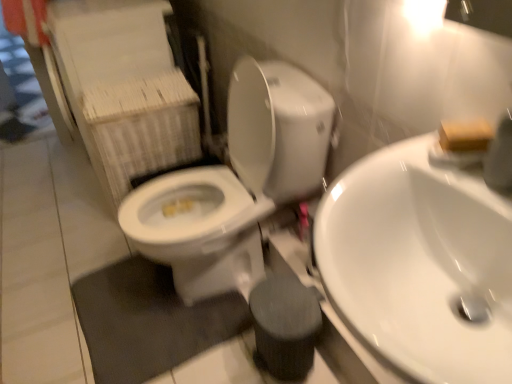
This screenshot has width=512, height=384. Identify the location of vacant region to the left of wooden block at upper right. (394, 161).